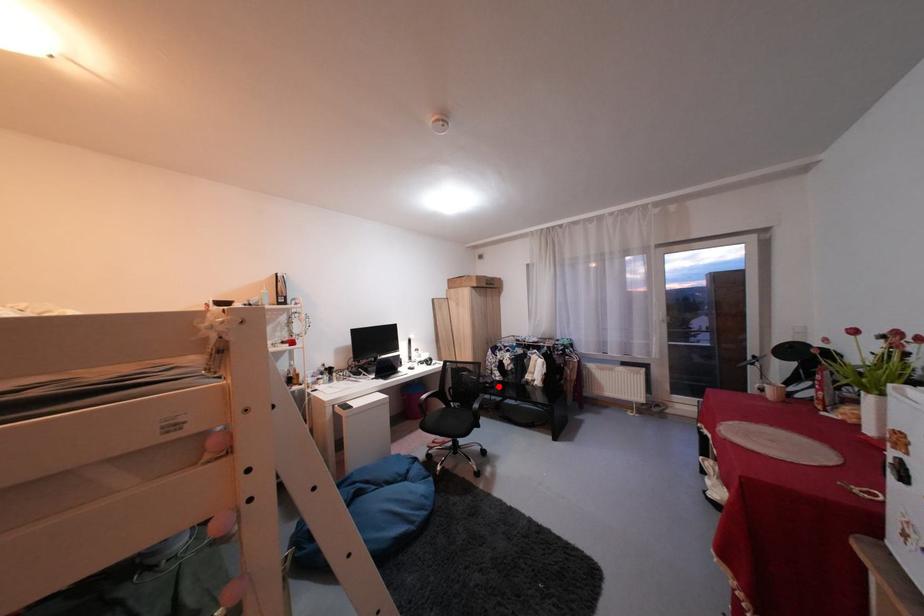
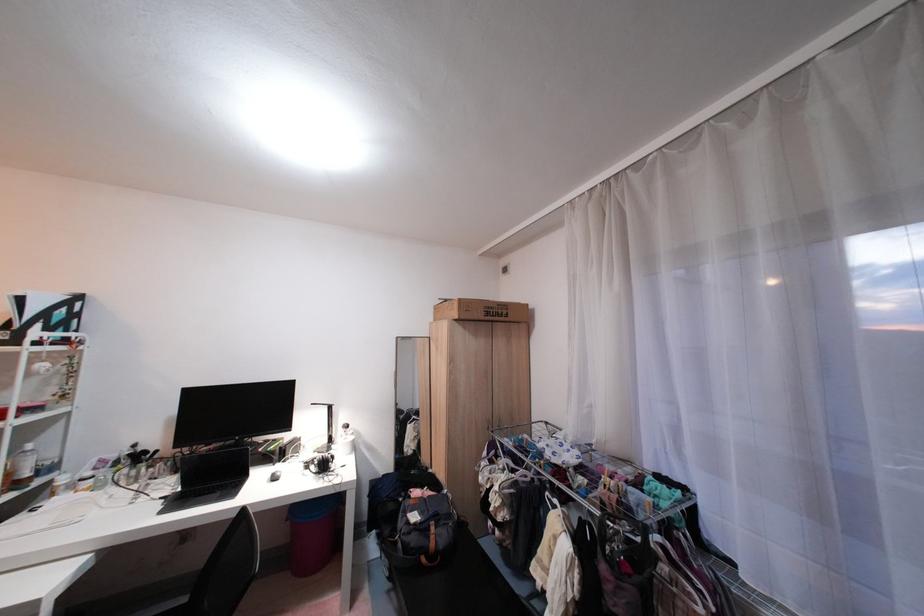
In the second image, find the point that corresponds to the highlighted location in the first image.

(434, 561)